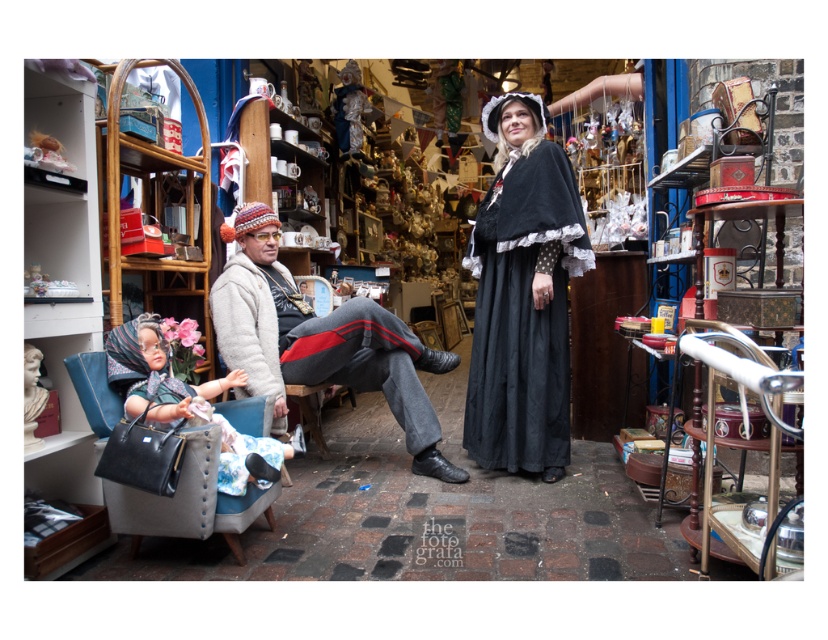
This screenshot has width=828, height=640. Find the location of `knitted woolen hat at center`. knitted woolen hat at center is located at coordinates (325, 340).

Does point (253, 353) come in front of point (99, 392)?

No, it is not.

You are a GUI agent. You are given a task and a screenshot of the screen. Output one action in this format:
    pyautogui.click(x=<x>, y=<y>)
    Task: Click on the knitted woolen hat at center
    This screenshot has height=640, width=828.
    Given the screenshot: What is the action you would take?
    pyautogui.click(x=325, y=340)

Who is positioned more to the right, black satin dress at center or matte black purse at lower left?

black satin dress at center

Is black satin dress at center to the left of matte black purse at lower left from the viewer's perspective?

No, black satin dress at center is not to the left of matte black purse at lower left.

Image resolution: width=828 pixels, height=640 pixels. I want to click on black satin dress at center, so click(x=522, y=296).

Who is lower down, black satin dress at center or knitted woolen hat at center?

Positioned lower is knitted woolen hat at center.

Which is in front, point (550, 371) or point (403, 387)?

Point (550, 371) is in front.

Is point (463, 420) positioned before point (215, 332)?

That is False.

You are a GUI agent. You are given a task and a screenshot of the screen. Output one action in this format:
    pyautogui.click(x=<x>, y=<y>)
    Task: Click on the black satin dress at center
    
    Given the screenshot: What is the action you would take?
    pyautogui.click(x=522, y=296)